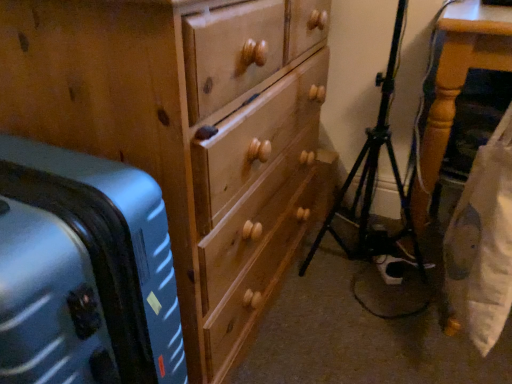
Question: Is wooden table at right further to camera compared to metallic blue suitcase at left?

Choices:
 (A) no
 (B) yes

Answer: (B)

Question: Does wooden table at right have a larger size compared to metallic blue suitcase at left?

Choices:
 (A) yes
 (B) no

Answer: (A)

Question: From a real-world perspective, is wooden table at right located beneath metallic blue suitcase at left?

Choices:
 (A) no
 (B) yes

Answer: (A)

Question: Would you say wooden table at right is outside metallic blue suitcase at left?

Choices:
 (A) no
 (B) yes

Answer: (B)

Question: From the image's perspective, is wooden table at right located above metallic blue suitcase at left?

Choices:
 (A) yes
 (B) no

Answer: (A)

Question: Would you say wooden table at right is to the left or to the right of wooden chest of drawers at center in the picture?

Choices:
 (A) right
 (B) left

Answer: (A)

Question: Considering the positions of wooden table at right and wooden chest of drawers at center in the image, is wooden table at right bigger or smaller than wooden chest of drawers at center?

Choices:
 (A) small
 (B) big

Answer: (A)

Question: Would you say wooden table at right is inside or outside wooden chest of drawers at center?

Choices:
 (A) outside
 (B) inside

Answer: (A)

Question: From the image's perspective, relative to wooden chest of drawers at center, is wooden table at right above or below?

Choices:
 (A) below
 (B) above

Answer: (B)

Question: Is wooden chest of drawers at center to the left or to the right of black metal tripod at lower right in the image?

Choices:
 (A) left
 (B) right

Answer: (A)

Question: Is wooden chest of drawers at center bigger or smaller than black metal tripod at lower right?

Choices:
 (A) big
 (B) small

Answer: (A)

Question: In terms of height, does wooden chest of drawers at center look taller or shorter compared to black metal tripod at lower right?

Choices:
 (A) short
 (B) tall

Answer: (B)

Question: Looking at their shapes, would you say wooden chest of drawers at center is wider or thinner than black metal tripod at lower right?

Choices:
 (A) wide
 (B) thin

Answer: (A)

Question: Considering the positions of point (312, 244) and point (195, 18), is point (312, 244) closer or farther from the camera than point (195, 18)?

Choices:
 (A) farther
 (B) closer

Answer: (A)

Question: From a real-world perspective, relative to wooden chest of drawers at center, is black metal tripod at lower right vertically above or below?

Choices:
 (A) above
 (B) below

Answer: (B)